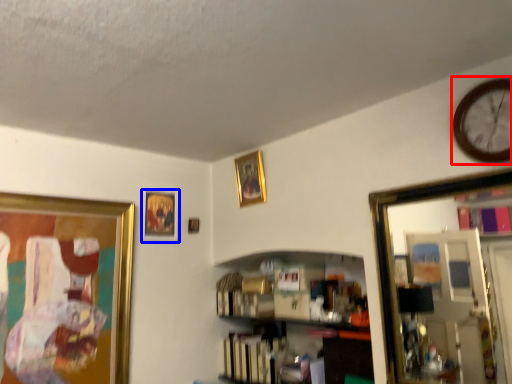
Question: Which point is closer to the camera, clock (highlighted by a red box) or picture frame (highlighted by a blue box)?

Choices:
 (A) clock
 (B) picture frame

Answer: (A)